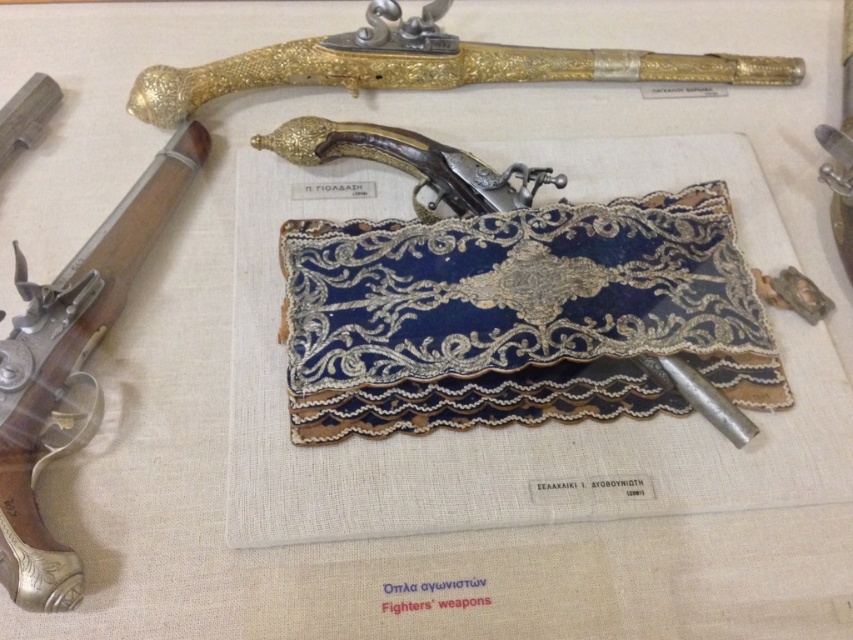
Question: Which point is farther to the camera?

Choices:
 (A) (755, 310)
 (B) (183, 145)
 (C) (592, 65)

Answer: (C)

Question: Can you confirm if blue embroidered cloth at center is positioned above polished silver handgun at left?

Choices:
 (A) yes
 (B) no

Answer: (B)

Question: Which of the following is the farthest from the observer?

Choices:
 (A) polished silver handgun at left
 (B) gold textured pistol at upper center
 (C) blue embroidered cloth at center

Answer: (B)

Question: Which of these objects is positioned farthest from the blue embroidered cloth at center?

Choices:
 (A) gold textured pistol at upper center
 (B) polished silver handgun at left

Answer: (B)

Question: Does polished silver handgun at left appear on the left side of gold textured pistol at upper center?

Choices:
 (A) no
 (B) yes

Answer: (B)

Question: Does blue embroidered cloth at center appear over polished silver handgun at left?

Choices:
 (A) no
 (B) yes

Answer: (A)